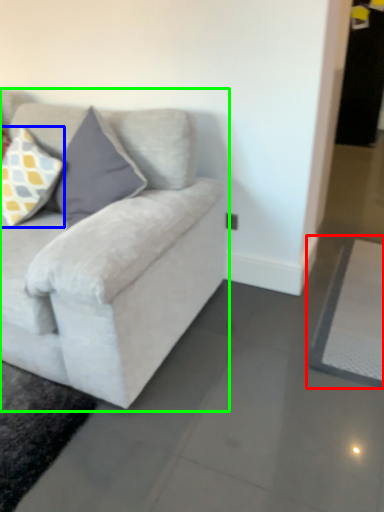
Question: Based on their relative distances, which object is nearer to yoga mat (highlighted by a red box)? Choose from pillow (highlighted by a blue box) and studio couch (highlighted by a green box).

Choices:
 (A) pillow
 (B) studio couch

Answer: (B)